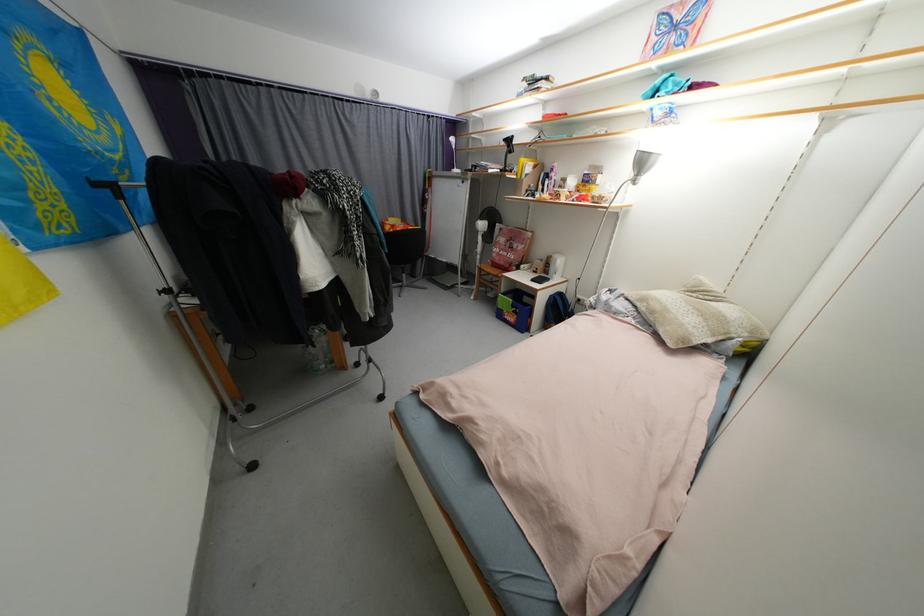
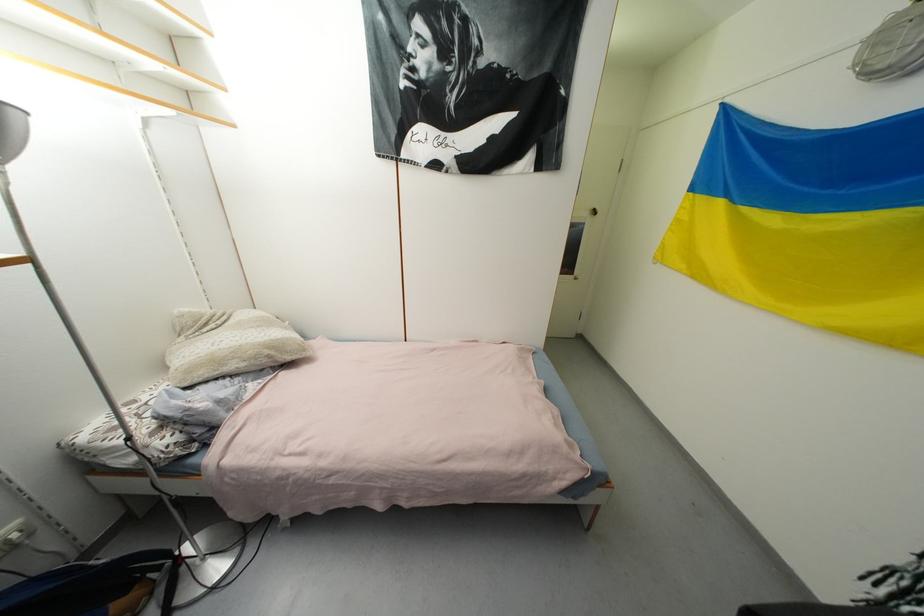
Locate, in the second image, the point that corresponds to [658,314] in the first image.

(261, 359)